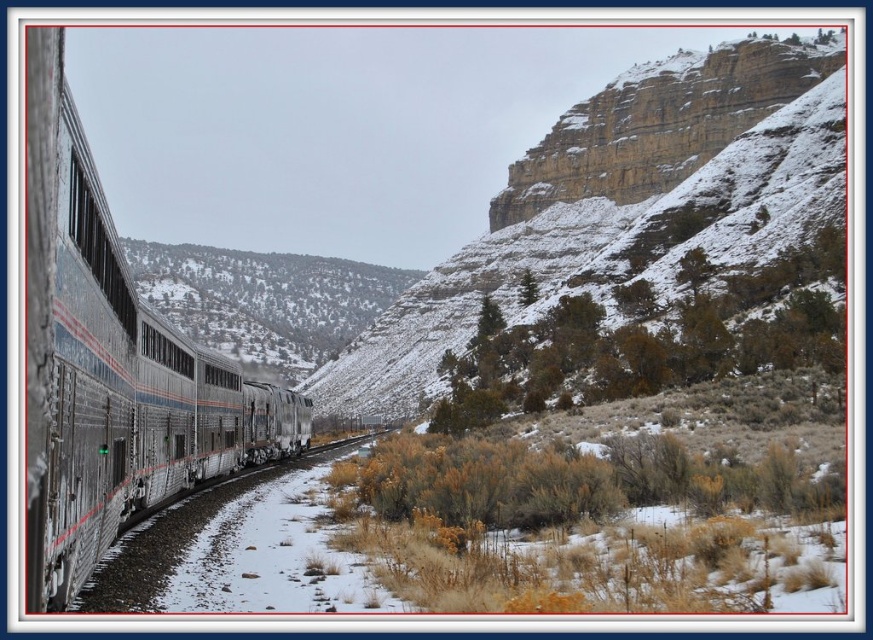
Can you confirm if snowy rocky cliff at upper right is positioned to the left of silver metallic train at left?

No, snowy rocky cliff at upper right is not to the left of silver metallic train at left.

Does snowy rocky cliff at upper right have a greater width compared to silver metallic train at left?

Yes, snowy rocky cliff at upper right is wider than silver metallic train at left.

Describe the element at coordinates (623, 204) in the screenshot. I see `snowy rocky cliff at upper right` at that location.

I want to click on snowy rocky cliff at upper right, so click(623, 204).